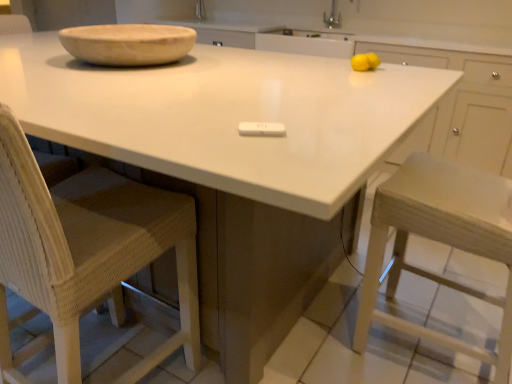
Measure the distance between woven wood chair at left and camera.

woven wood chair at left is 28.32 inches away from camera.

This screenshot has height=384, width=512. Describe the element at coordinates (84, 250) in the screenshot. I see `woven wood chair at left` at that location.

What do you see at coordinates (128, 44) in the screenshot? I see `wooden bowl at upper left` at bounding box center [128, 44].

The image size is (512, 384). I want to click on white glossy countertop at center, so click(224, 116).

You are a GUI agent. You are given a task and a screenshot of the screen. Output one action in this format:
    pyautogui.click(x=<x>, y=<y>)
    Task: Click on the woven wood chair at left
    
    Given the screenshot: What is the action you would take?
    pyautogui.click(x=84, y=250)

Locate an element on the screen. countertop on the left of wooden bowl at upper left is located at coordinates (224, 116).

From a real-world perspective, does white glossy countertop at center sit lower than wooden bowl at upper left?

Correct, in the physical world, white glossy countertop at center is lower than wooden bowl at upper left.

Considering the sizes of objects white glossy countertop at center and wooden bowl at upper left in the image provided, who is shorter, white glossy countertop at center or wooden bowl at upper left?

wooden bowl at upper left is shorter.

From the image's perspective, is white glossy countertop at center over wooden bowl at upper left?

Actually, white glossy countertop at center appears below wooden bowl at upper left in the image.

Is white glossy countertop at center bigger than woven wood chair at left?

Yes.

Which object is thinner, white glossy countertop at center or woven wood chair at left?

Thinner between the two is woven wood chair at left.

Considering the positions of point (434, 73) and point (51, 301), is point (434, 73) closer or farther from the camera than point (51, 301)?

Clearly, point (434, 73) is more distant from the camera than point (51, 301).

Is woven wood chair at left surrounded by white glossy countertop at center?

Indeed, woven wood chair at left is located within white glossy countertop at center.

From the image's perspective, which one is positioned lower, wooden bowl at upper left or white glossy countertop at center?

white glossy countertop at center, from the image's perspective.

Consider the image. Choose the correct answer: Is wooden bowl at upper left inside white glossy countertop at center or outside it?

wooden bowl at upper left is outside white glossy countertop at center.

From a real-world perspective, who is located lower, wooden bowl at upper left or white glossy countertop at center?

From a 3D spatial view, white glossy countertop at center is below.

Identify the location of chair that appears below the wooden bowl at upper left (from a real-world perspective). (84, 250).

Would you say woven wood chair at left contains wooden bowl at upper left?

That's incorrect, wooden bowl at upper left is not inside woven wood chair at left.

Would you say woven wood chair at left is a long distance from wooden bowl at upper left?

They are positioned close to each other.

Can you tell me how much woven wood chair at left and wooden bowl at upper left differ in facing direction?

179 degrees.

Does point (3, 183) come farther from viewer compared to point (201, 90)?

That is False.

How different are the orientations of woven wood chair at left and white glossy countertop at center in degrees?

There is a 180-degree angle between the facing directions of woven wood chair at left and white glossy countertop at center.

Can you confirm if woven wood chair at left is shorter than white glossy countertop at center?

No, woven wood chair at left is not shorter than white glossy countertop at center.

Is point (156, 50) closer or farther from the camera than point (173, 205)?

Point (156, 50) is positioned farther from the camera compared to point (173, 205).

Considering the relative sizes of wooden bowl at upper left and woven wood chair at left in the image provided, is wooden bowl at upper left smaller than woven wood chair at left?

Indeed, wooden bowl at upper left has a smaller size compared to woven wood chair at left.

From the image's perspective, which one is positioned lower, wooden bowl at upper left or woven wood chair at left?

woven wood chair at left appears lower in the image.

The image size is (512, 384). What are the coordinates of `countertop below the wooden bowl at upper left (from a real-world perspective)` in the screenshot? It's located at [224, 116].

I want to click on countertop above the woven wood chair at left (from the image's perspective), so click(x=224, y=116).

When comparing their distances from woven wood chair at left, does wooden bowl at upper left or white glossy countertop at center seem closer?

white glossy countertop at center is positioned closer to the anchor woven wood chair at left.

From the image, which object appears to be nearer to woven wood chair at left, white glossy countertop at center or wooden bowl at upper left?

white glossy countertop at center is positioned closer to the anchor woven wood chair at left.

Based on their spatial positions, is woven wood chair at left or white glossy countertop at center further from wooden bowl at upper left?

woven wood chair at left.

Estimate the real-world distances between objects in this image. Which object is closer to wooden bowl at upper left, white glossy countertop at center or woven wood chair at left?

white glossy countertop at center.

Based on their spatial positions, is woven wood chair at left or wooden bowl at upper left closer to white glossy countertop at center?

Based on the image, wooden bowl at upper left appears to be nearer to white glossy countertop at center.

Based on their spatial positions, is wooden bowl at upper left or woven wood chair at left closer to white glossy countertop at center?

wooden bowl at upper left is positioned closer to the anchor white glossy countertop at center.

Identify the location of chair between white glossy countertop at center and wooden bowl at upper left in the front-back direction. (84, 250).